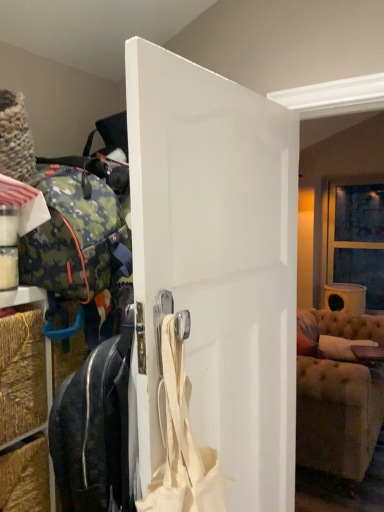
Question: From the image's perspective, would you say black leather suitcase at center, placed as the 1th luggage and bags when sorted from bottom to top, is positioned over beige fabric shoulder bag at center?

Choices:
 (A) yes
 (B) no

Answer: (B)

Question: Can you confirm if black leather suitcase at center, which appears as the 2th luggage and bags when viewed from the top, is shorter than beige fabric shoulder bag at center?

Choices:
 (A) yes
 (B) no

Answer: (B)

Question: From a real-world perspective, is black leather suitcase at center, which appears as the 2th luggage and bags when viewed from the top, located beneath beige fabric shoulder bag at center?

Choices:
 (A) yes
 (B) no

Answer: (A)

Question: Does black leather suitcase at center, which appears as the 2th luggage and bags when viewed from the top, have a lesser width compared to beige fabric shoulder bag at center?

Choices:
 (A) yes
 (B) no

Answer: (A)

Question: Is black leather suitcase at center, placed as the 1th luggage and bags when sorted from bottom to top, further to camera compared to beige fabric shoulder bag at center?

Choices:
 (A) yes
 (B) no

Answer: (A)

Question: Is point (130, 167) positioned closer to the camera than point (49, 251)?

Choices:
 (A) closer
 (B) farther

Answer: (A)

Question: Is white matte door at center to the left or to the right of camo fabric backpack at left, which is counted as the 1th luggage and bags, starting from the top, in the image?

Choices:
 (A) left
 (B) right

Answer: (B)

Question: Is white matte door at center wider or thinner than camo fabric backpack at left, the 2th luggage and bags ordered from the bottom?

Choices:
 (A) thin
 (B) wide

Answer: (A)

Question: In terms of size, does white matte door at center appear bigger or smaller than camo fabric backpack at left, which is counted as the 1th luggage and bags, starting from the top?

Choices:
 (A) small
 (B) big

Answer: (A)

Question: Looking at their shapes, would you say black leather suitcase at center, placed as the 1th luggage and bags when sorted from bottom to top, is wider or thinner than white matte door at center?

Choices:
 (A) thin
 (B) wide

Answer: (B)

Question: Which is correct: black leather suitcase at center, placed as the 1th luggage and bags when sorted from bottom to top, is inside white matte door at center, or outside of it?

Choices:
 (A) inside
 (B) outside

Answer: (B)

Question: From a real-world perspective, relative to white matte door at center, is black leather suitcase at center, placed as the 1th luggage and bags when sorted from bottom to top, vertically above or below?

Choices:
 (A) above
 (B) below

Answer: (B)

Question: Is point (92, 374) positioned closer to the camera than point (163, 58)?

Choices:
 (A) closer
 (B) farther

Answer: (B)

Question: Is tufted fabric couch at right bigger or smaller than black leather suitcase at center, placed as the 1th luggage and bags when sorted from bottom to top?

Choices:
 (A) small
 (B) big

Answer: (B)

Question: From a real-world perspective, is tufted fabric couch at right above or below black leather suitcase at center, placed as the 1th luggage and bags when sorted from bottom to top?

Choices:
 (A) above
 (B) below

Answer: (B)